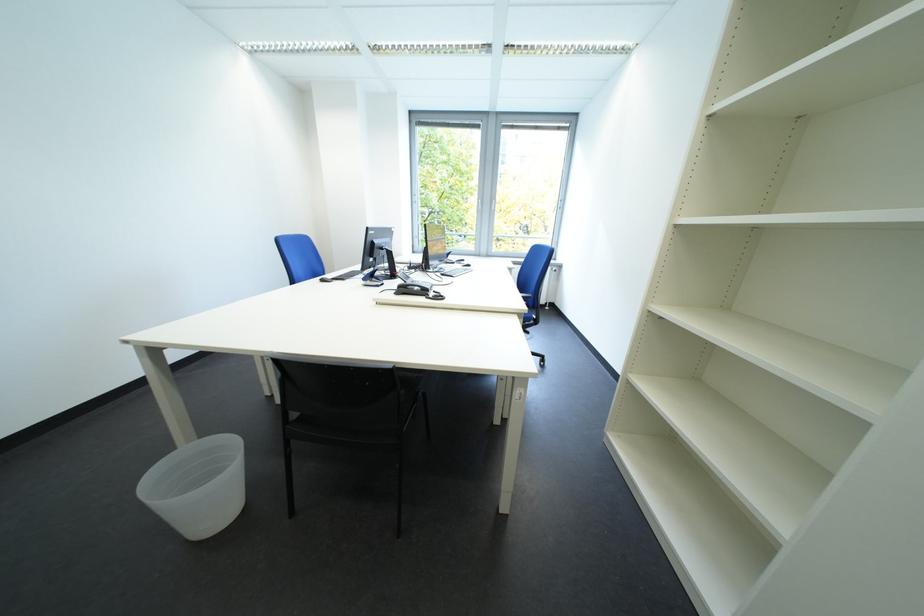
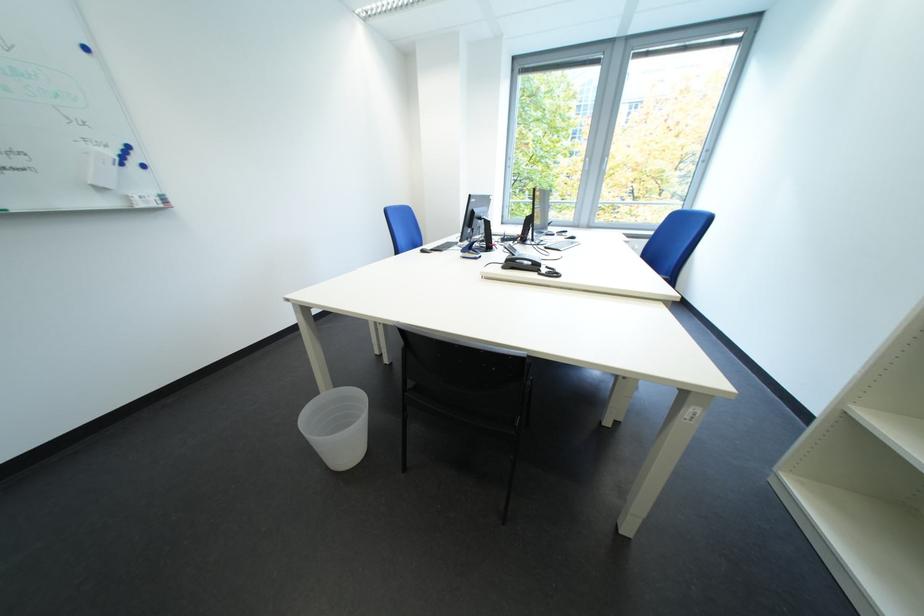
Locate, in the second image, the point that corresponds to point (327, 278) in the first image.

(427, 248)